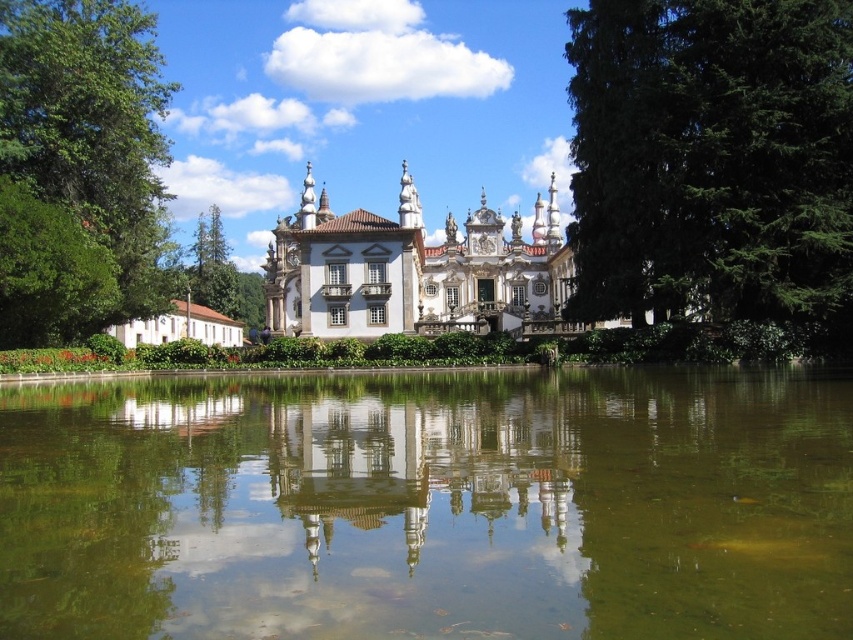
Question: Which of the following is the farthest from the observer?

Choices:
 (A) transparent glass reflection at center
 (B) white ornate palace at center
 (C) green textured tree at right

Answer: (B)

Question: Among these objects, which one is nearest to the camera?

Choices:
 (A) white ornate palace at center
 (B) green textured tree at right
 (C) green reflective water at center
 (D) green leafy tree at left

Answer: (C)

Question: From the image, what is the correct spatial relationship of green reflective water at center in relation to green leafy tree at left?

Choices:
 (A) above
 (B) below

Answer: (B)

Question: Is green reflective water at center below transparent glass reflection at center?

Choices:
 (A) yes
 (B) no

Answer: (B)

Question: Does transparent glass reflection at center appear over white ornate palace at center?

Choices:
 (A) yes
 (B) no

Answer: (B)

Question: Which is nearer to the white ornate palace at center?

Choices:
 (A) green textured tree at right
 (B) green reflective water at center
 (C) green leafy tree at left

Answer: (A)